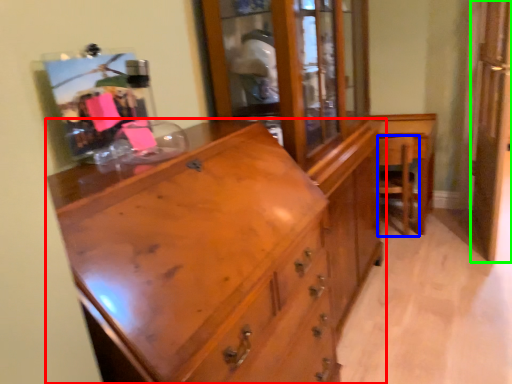
Question: Considering the real-world distances, which object is closest to chest of drawers (highlighted by a red box)? armchair (highlighted by a blue box) or screen door (highlighted by a green box).

Choices:
 (A) armchair
 (B) screen door

Answer: (A)